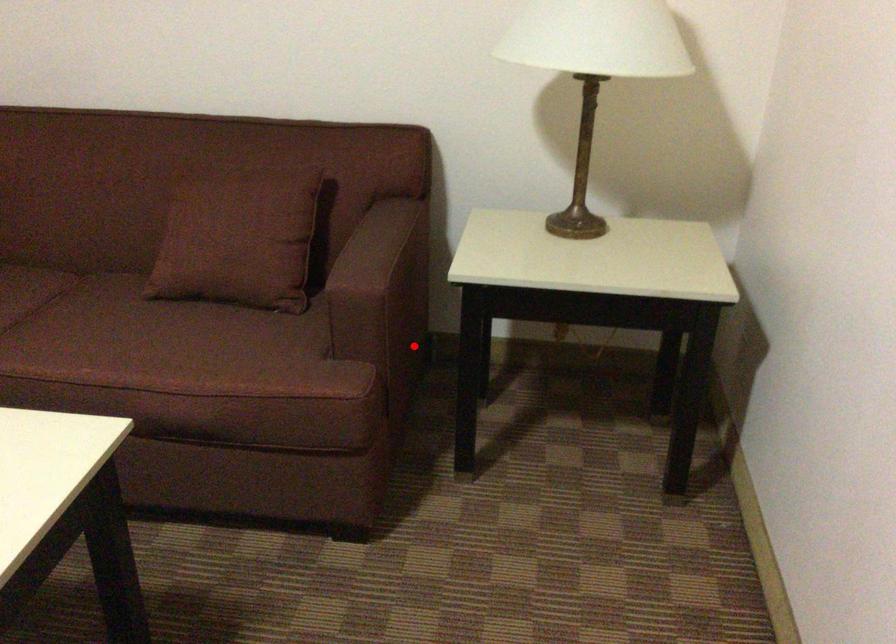
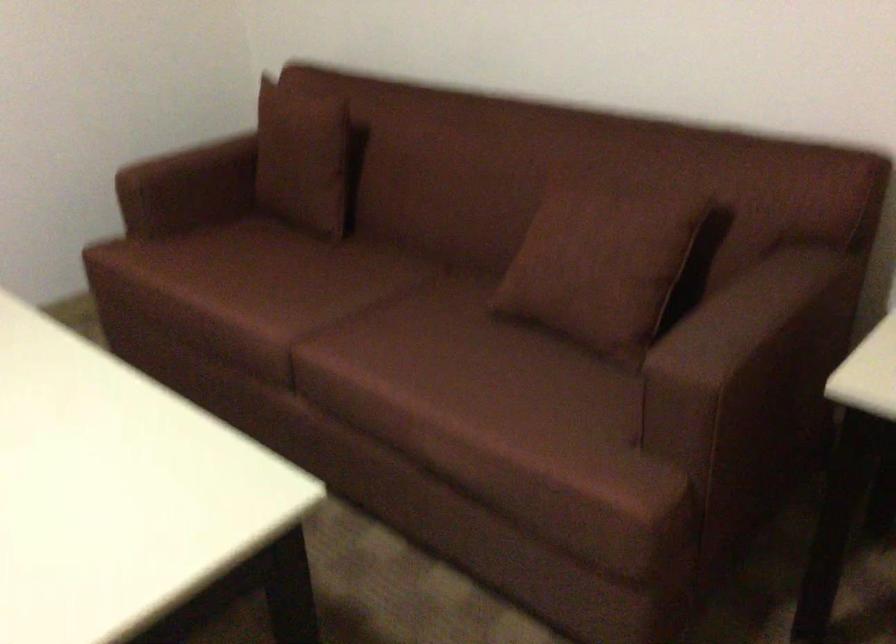
The point at the highlighted location is marked in the first image. Where is the corresponding point in the second image?

(791, 446)